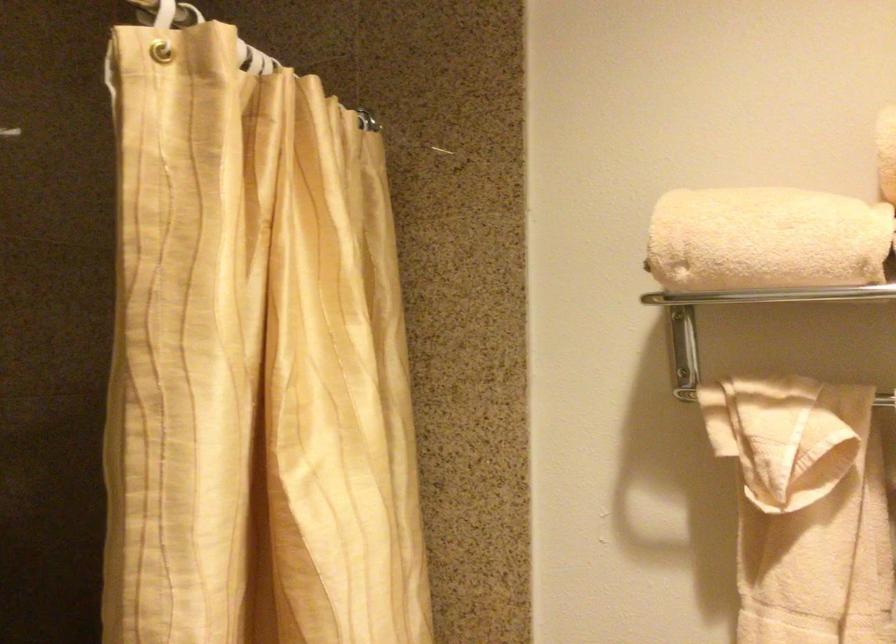
You are a GUI agent. You are given a task and a screenshot of the screen. Output one action in this format:
    pyautogui.click(x=<x>, y=<y>)
    Task: Click on the rolled beige towel
    This screenshot has height=644, width=896.
    Given the screenshot: What is the action you would take?
    pyautogui.click(x=765, y=240)